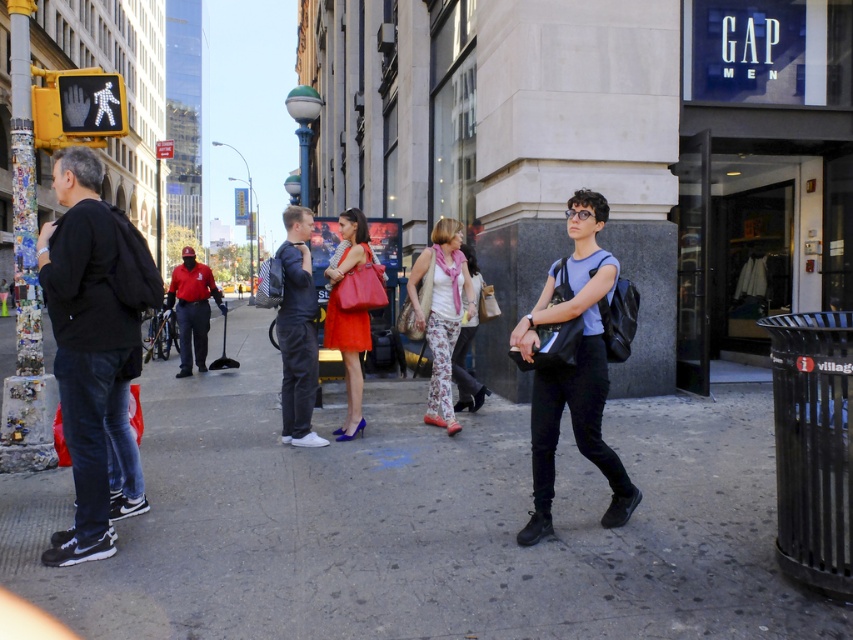
Question: Does matte black backpack at center come in front of floral pants at center?

Choices:
 (A) no
 (B) yes

Answer: (B)

Question: Estimate the real-world distances between objects in this image. Which object is farther from the concrete sidewalk at center?

Choices:
 (A) matte red handbag at center
 (B) floral pants at center

Answer: (A)

Question: Can you confirm if dark blue jeans at center is smaller than floral pants at center?

Choices:
 (A) no
 (B) yes

Answer: (B)

Question: Which point is closer to the camera?

Choices:
 (A) (399, 442)
 (B) (189, 289)

Answer: (A)

Question: Which of the following is the closest to the observer?

Choices:
 (A) red uniform at center
 (B) black matte hoodie at left

Answer: (B)

Question: Is dark blue jeans at center closer to camera compared to red uniform at center?

Choices:
 (A) yes
 (B) no

Answer: (A)